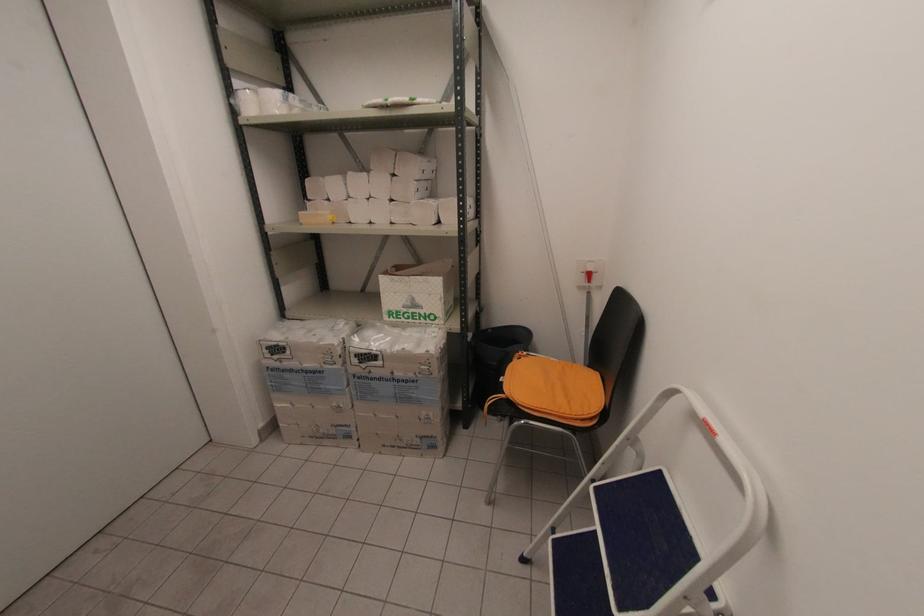
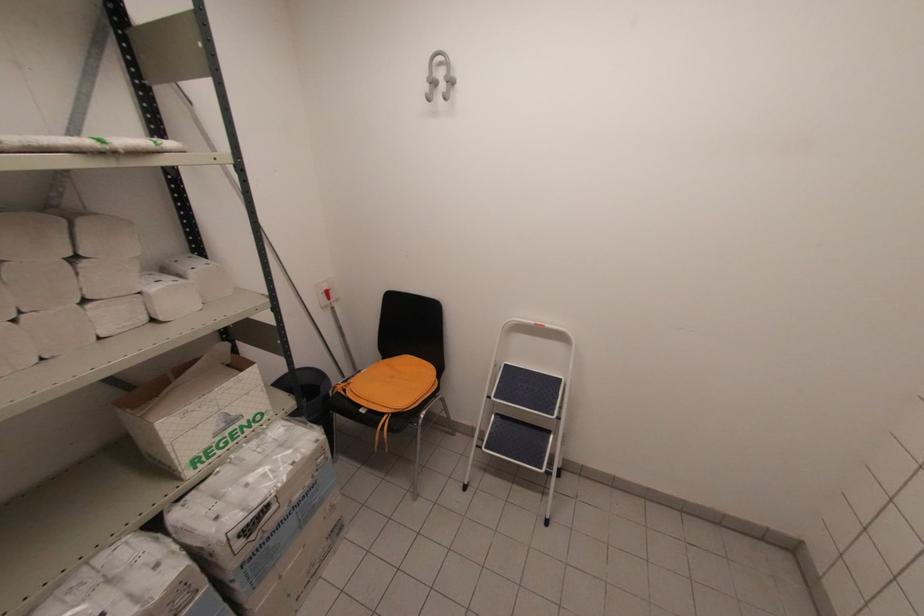
The point at [553,360] is marked in the first image. Where is the corresponding point in the second image?

(362, 371)